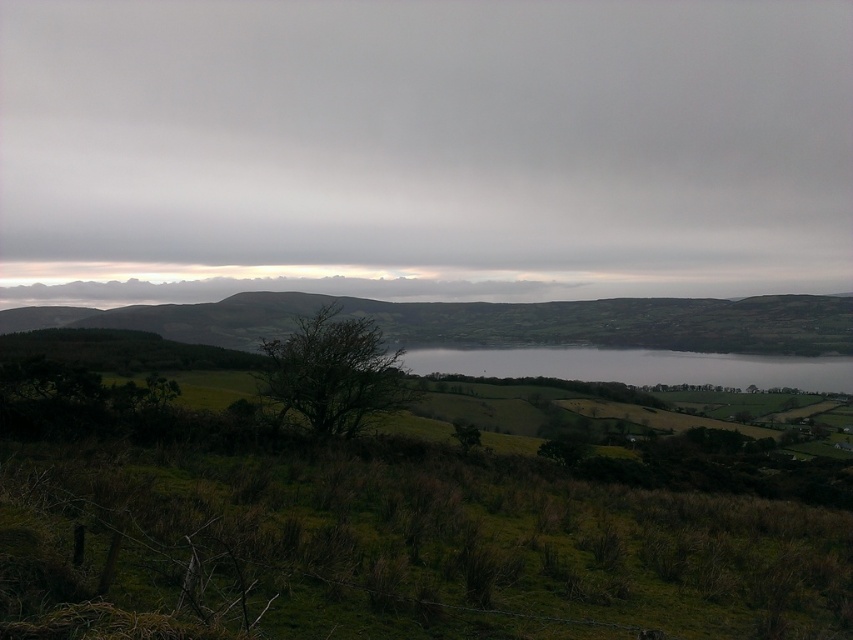
Question: Which object is positioned closest to the green grassy at lower center?

Choices:
 (A) gray cloudy sky at upper center
 (B) green grassy hillside at lower left
 (C) gray water at center

Answer: (C)

Question: Observing the image, what is the correct spatial positioning of gray cloudy sky at upper center in reference to gray water at center?

Choices:
 (A) below
 (B) above

Answer: (B)

Question: Can you confirm if gray cloudy sky at upper center is thinner than green grassy hillside at lower left?

Choices:
 (A) no
 (B) yes

Answer: (A)

Question: Does gray cloudy sky at upper center appear over green grassy hillside at lower left?

Choices:
 (A) no
 (B) yes

Answer: (B)

Question: Which of the following is the closest to the observer?

Choices:
 (A) (498, 371)
 (B) (254, 330)
 (C) (711, 508)

Answer: (C)

Question: Which of the following is the closest to the observer?

Choices:
 (A) (76, 90)
 (B) (810, 353)
 (C) (296, 584)

Answer: (C)